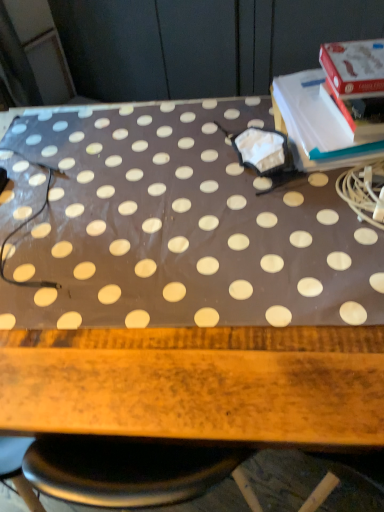
I want to click on free space to the left of white paper at upper right, so click(x=196, y=143).